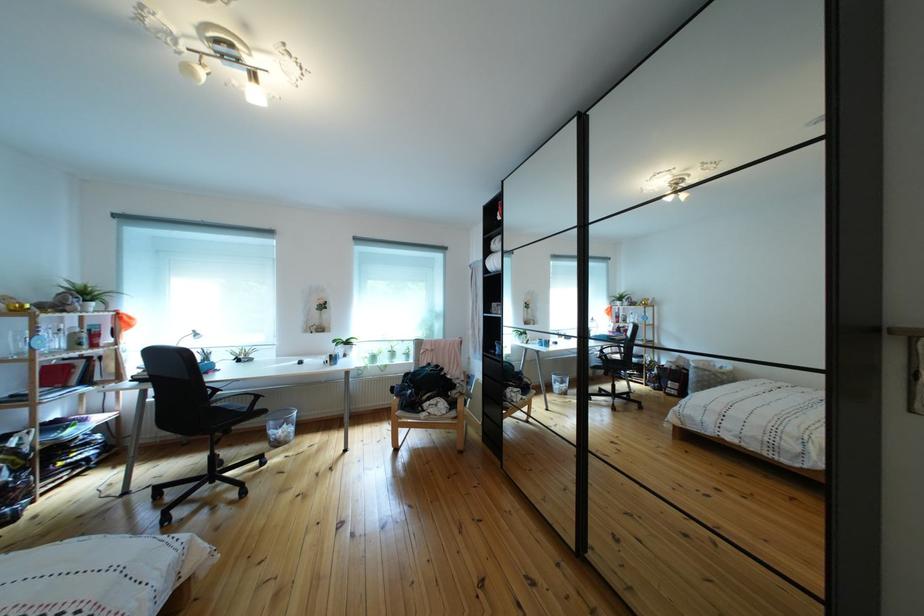
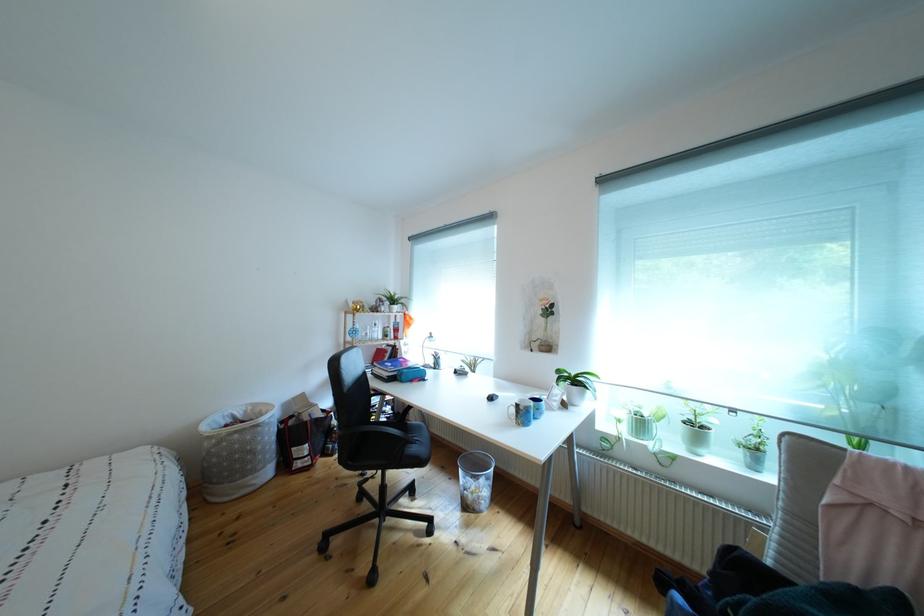
In the second image, find the point that corresponds to (289,450) in the first image.

(477, 512)